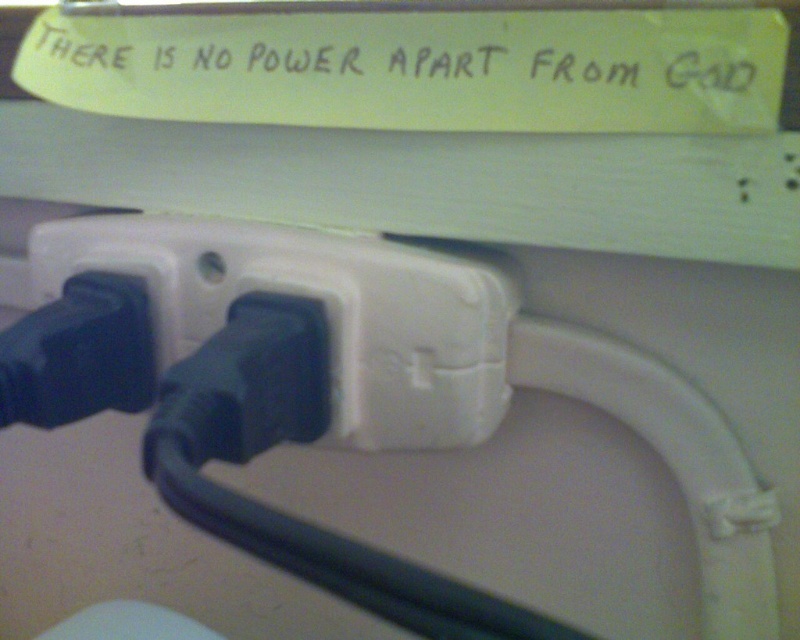
You are setting up a new lamp and need to plug it into the nearest available outlet. You see the white plastic power outlet at center and the yellow paper at upper center. Which object is located lower in the image?

The white plastic power outlet at center is located below the yellow paper at upper center, so it is the lower object in the image.

You have a new plug that is 10 cm wide and need to plug it into the white plastic power outlet at center. The yellow paper at upper center is currently covering part of the outlet. Can the plug fit into the outlet if you move the yellow paper out of the way?

The white plastic power outlet at center has a width less than the yellow paper at upper center. Since the yellow paper is covering part of the outlet, moving it might reveal enough space. However, since the outlet is narrower than the paper, if the plug is 10 cm wide and the outlet is smaller, it may not fit. Check the outlet size before attempting.